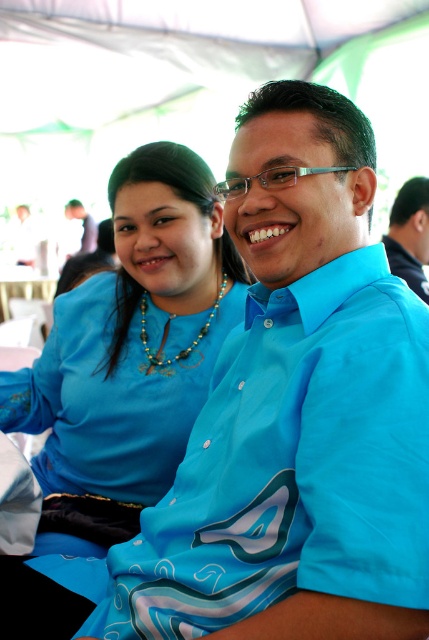
Question: Which of the following is the closest to the observer?

Choices:
 (A) (108, 493)
 (B) (401, 220)
 (C) (81, 209)

Answer: (A)

Question: Is blue fabric shirt at center in front of matte black shirt at upper left?

Choices:
 (A) yes
 (B) no

Answer: (A)

Question: Which is nearer to the blue fabric shirt at center?

Choices:
 (A) matte blue blouse at left
 (B) matte black shirt at upper left

Answer: (A)

Question: Is matte blue blouse at left bigger than matte black shirt at upper left?

Choices:
 (A) yes
 (B) no

Answer: (B)

Question: Which of these objects is positioned closest to the matte black shirt at upper left?

Choices:
 (A) matte blue blouse at left
 (B) blue fabric shirt at center

Answer: (B)

Question: Is blue fabric shirt at center in front of matte black shirt at upper left?

Choices:
 (A) no
 (B) yes

Answer: (B)